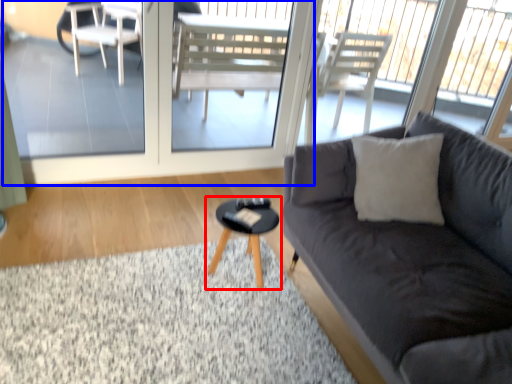
Question: Which point is further to the camera, coffee table (highlighted by a red box) or screen door (highlighted by a blue box)?

Choices:
 (A) coffee table
 (B) screen door

Answer: (B)